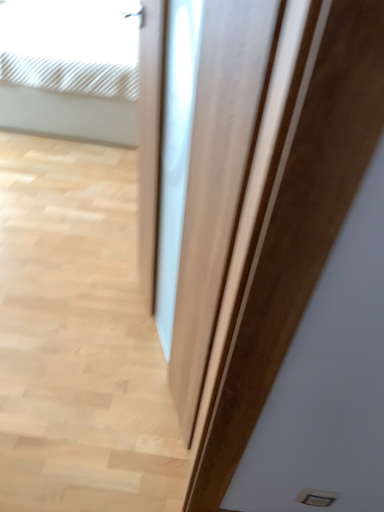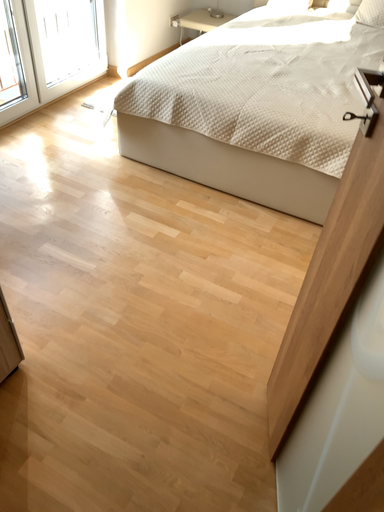
Question: How did the camera likely rotate when shooting the video?

Choices:
 (A) rotated right
 (B) rotated left

Answer: (B)